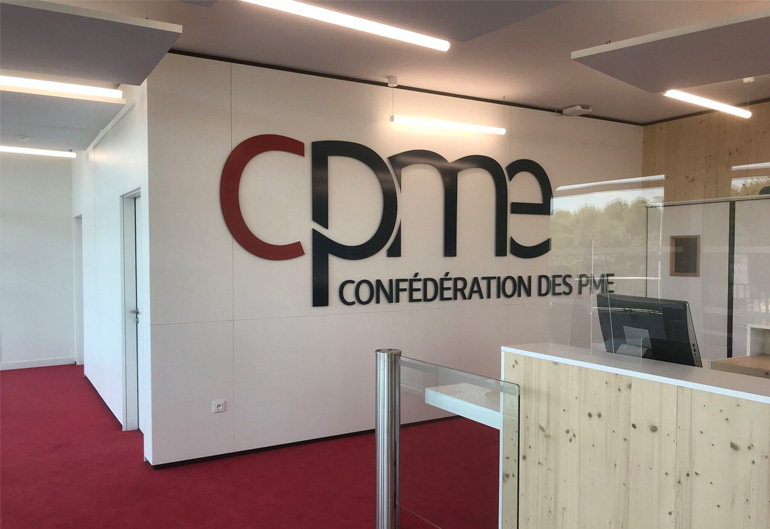
You are a GUI agent. You are given a task and a screenshot of the screen. Output one action in this format:
    pyautogui.click(x=<x>, y=<y>)
    Task: Click on the 2 different types of walls
    The height and width of the screenshot is (529, 770).
    Given the screenshot: What is the action you would take?
    tap(223, 329), tap(683, 152)